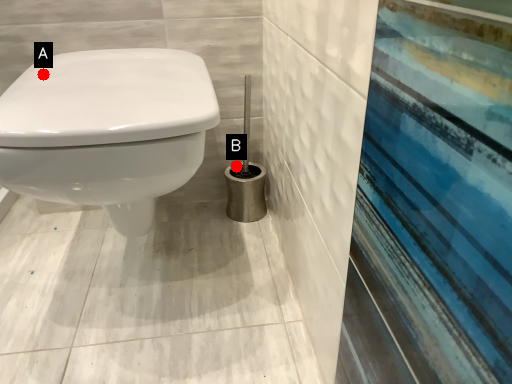
Question: Two points are circled on the image, labeled by A and B beside each circle. Which point is further to the camera?

Choices:
 (A) A is further
 (B) B is further

Answer: (B)